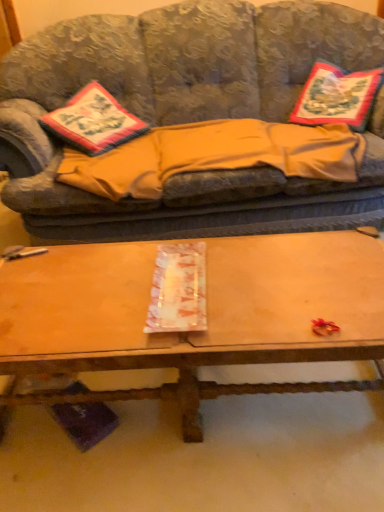
Question: Can you confirm if beige fleece blanket at center is thinner than embroidered fabric pillow at left?

Choices:
 (A) yes
 (B) no

Answer: (B)

Question: Can you confirm if beige fleece blanket at center is smaller than embroidered fabric pillow at left?

Choices:
 (A) no
 (B) yes

Answer: (A)

Question: Is beige fleece blanket at center oriented towards embroidered fabric pillow at left?

Choices:
 (A) no
 (B) yes

Answer: (A)

Question: Does beige fleece blanket at center have a greater width compared to embroidered fabric pillow at left?

Choices:
 (A) no
 (B) yes

Answer: (B)

Question: Does beige fleece blanket at center lie in front of embroidered fabric pillow at left?

Choices:
 (A) no
 (B) yes

Answer: (B)

Question: Is beige fleece blanket at center beside embroidered fabric pillow at left?

Choices:
 (A) yes
 (B) no

Answer: (B)

Question: From the image's perspective, is embroidered fabric pillow at left located beneath wooden at center?

Choices:
 (A) no
 (B) yes

Answer: (A)

Question: Would you say embroidered fabric pillow at left contains wooden at center?

Choices:
 (A) yes
 (B) no

Answer: (B)

Question: Can you confirm if embroidered fabric pillow at left is thinner than wooden at center?

Choices:
 (A) no
 (B) yes

Answer: (B)

Question: Are embroidered fabric pillow at left and wooden at center far apart?

Choices:
 (A) yes
 (B) no

Answer: (B)

Question: From a real-world perspective, is embroidered fabric pillow at left beneath wooden at center?

Choices:
 (A) yes
 (B) no

Answer: (B)

Question: Does embroidered fabric pillow at left have a greater width compared to wooden at center?

Choices:
 (A) no
 (B) yes

Answer: (A)

Question: Considering the relative sizes of beige fleece blanket at center and embroidered fabric pillow at upper right in the image provided, is beige fleece blanket at center wider than embroidered fabric pillow at upper right?

Choices:
 (A) no
 (B) yes

Answer: (B)